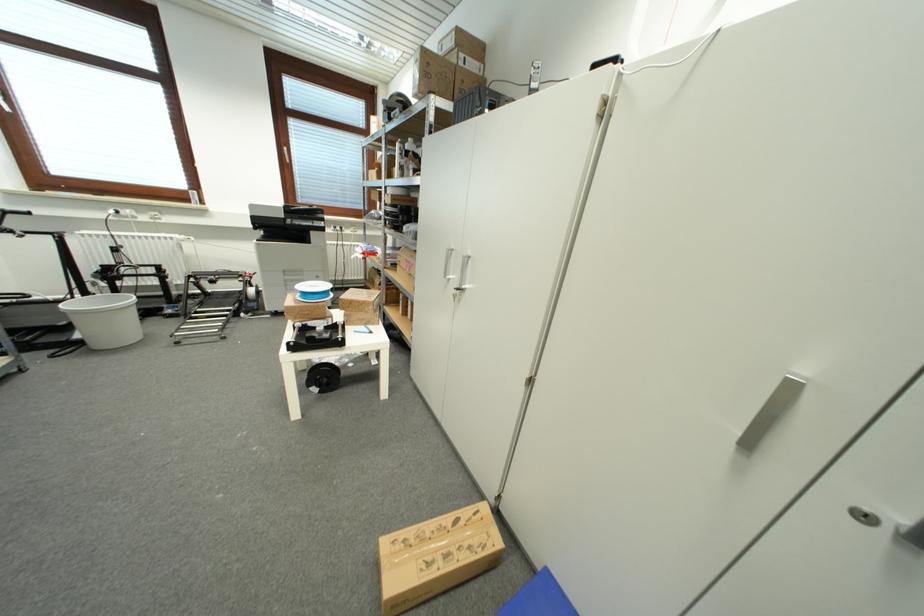
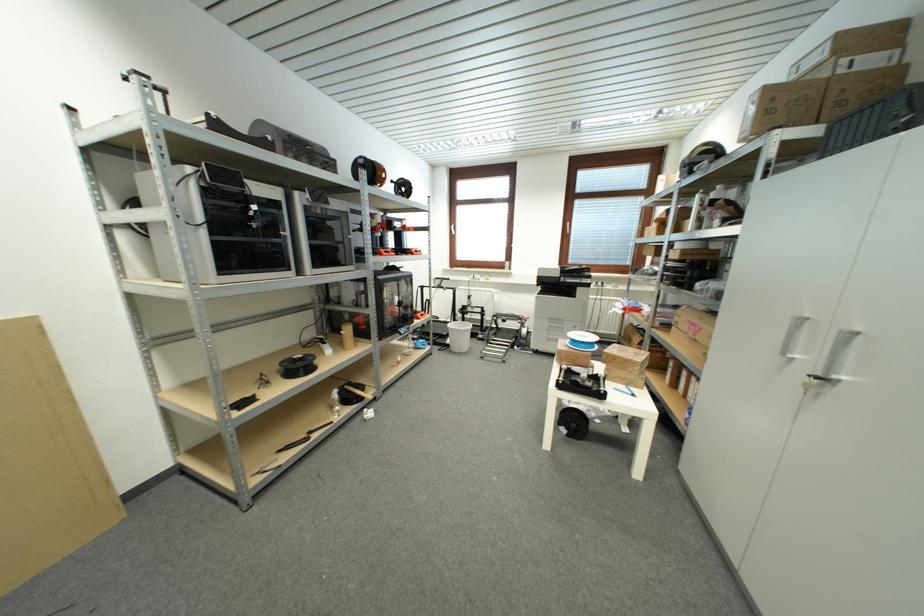
The point at (321,289) is marked in the first image. Where is the corresponding point in the second image?

(590, 339)